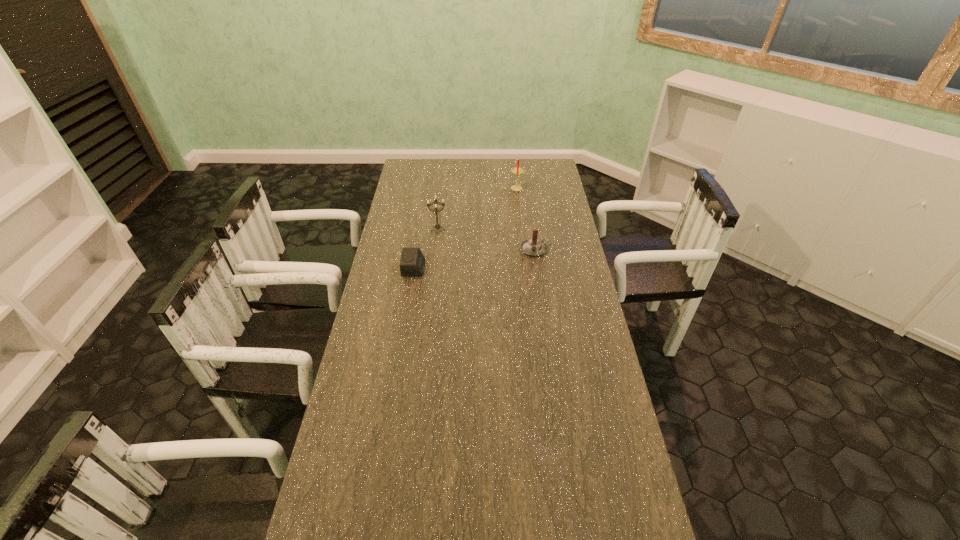
This screenshot has width=960, height=540. I want to click on vacant position located on the front-facing side of the alarm clock, so click(492, 268).

Image resolution: width=960 pixels, height=540 pixels. Identify the location of object that is positioned at the left edge. click(412, 263).

Image resolution: width=960 pixels, height=540 pixels. I want to click on object located in the right edge section of the desktop, so click(533, 247).

This screenshot has height=540, width=960. In the image, there is a desktop. In order to click on vacant region at the far edge in this screenshot , I will do `click(497, 159)`.

Identify the location of free spot at the left edge of the desktop. (373, 516).

Image resolution: width=960 pixels, height=540 pixels. Find the location of `free space at the right edge of the desktop`. free space at the right edge of the desktop is located at coordinates (553, 208).

The height and width of the screenshot is (540, 960). Identify the location of free space at the far right corner of the desktop. (560, 174).

Image resolution: width=960 pixels, height=540 pixels. What are the coordinates of `vacant area between the shortest object and the second shortest object` in the screenshot? It's located at (474, 259).

The image size is (960, 540). Identify the location of free space between the taller candle and the shortest object. (466, 228).

At what (x,y) coordinates should I click in order to perform the action: click on free space between the third tallest object and the farther candle. Please return your answer as a coordinate pair (x, y). The width and height of the screenshot is (960, 540). Looking at the image, I should click on (527, 219).